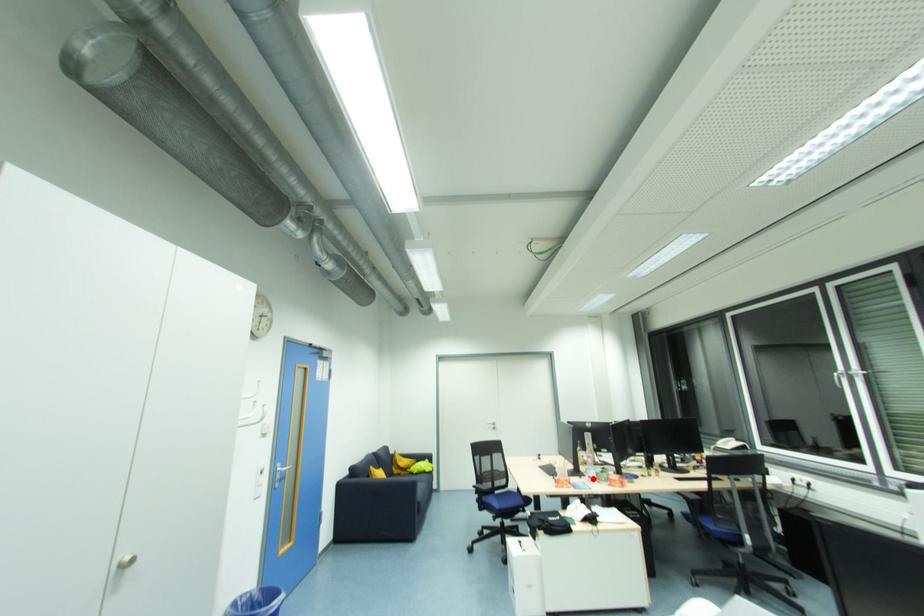
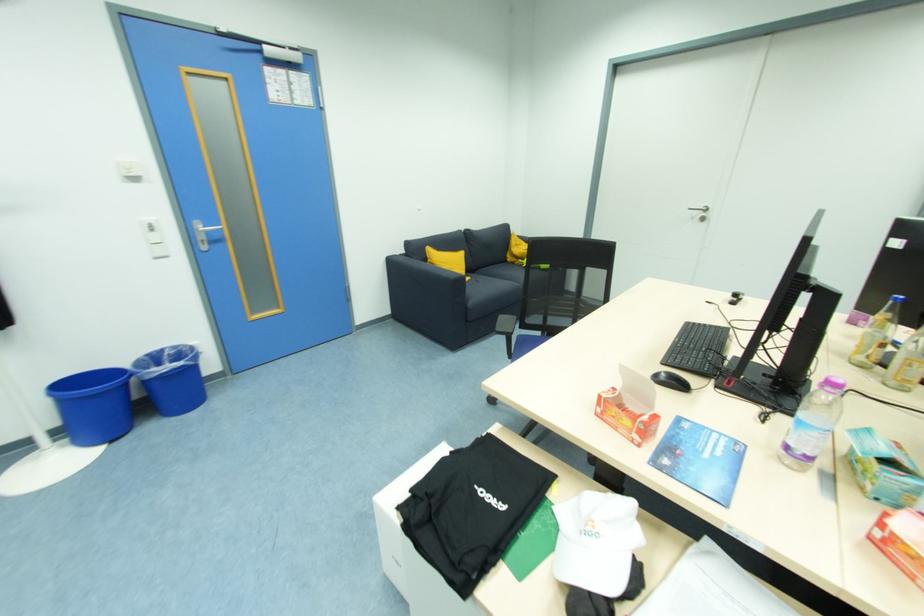
Question: I am providing you with two images of the same scene from different viewpoints. In image1, a red point is highlighted. Considering the same 3D point in image2, which of the following is correct?

Choices:
 (A) It is closer
 (B) It is farther

Answer: (A)